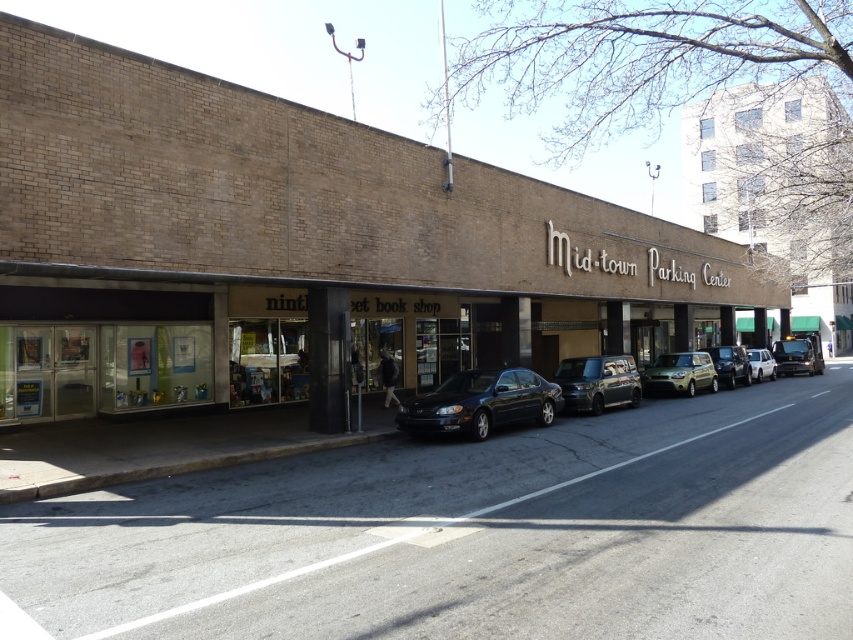
From the picture: You are a delivery person trying to park your vehicle between the shiny black sedan at center and the white matte van at right. According to the scene, which vehicle should you position your car behind to ensure proper parking alignment?

The shiny black sedan at center is above the white matte van at right, so you should position your car behind the white matte van at right to maintain proper parking alignment.

You are a delivery driver who needs to park your truck on the black asphalt road at center. However, there is a white matte van at right blocking the road. Can you safely park your truck there?

The black asphalt road at center is positioned under white matte van at right, meaning the van is parked over the road. This would block access, so you cannot safely park your truck there.

In the scene shown: You are driving a white matte van at right and want to park on the black asphalt road at center. Based on the scene description, can your van fit on the road without overhanging the edges?

The black asphalt road at center is wider than the white matte van at right, so yes, the van can fit on the road without overhanging the edges.